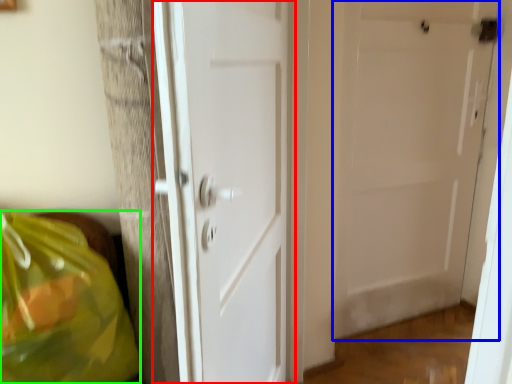
Question: Which object is the closest to the door (highlighted by a red box)? Choose among these: door (highlighted by a blue box) or grocery bag (highlighted by a green box).

Choices:
 (A) door
 (B) grocery bag

Answer: (B)